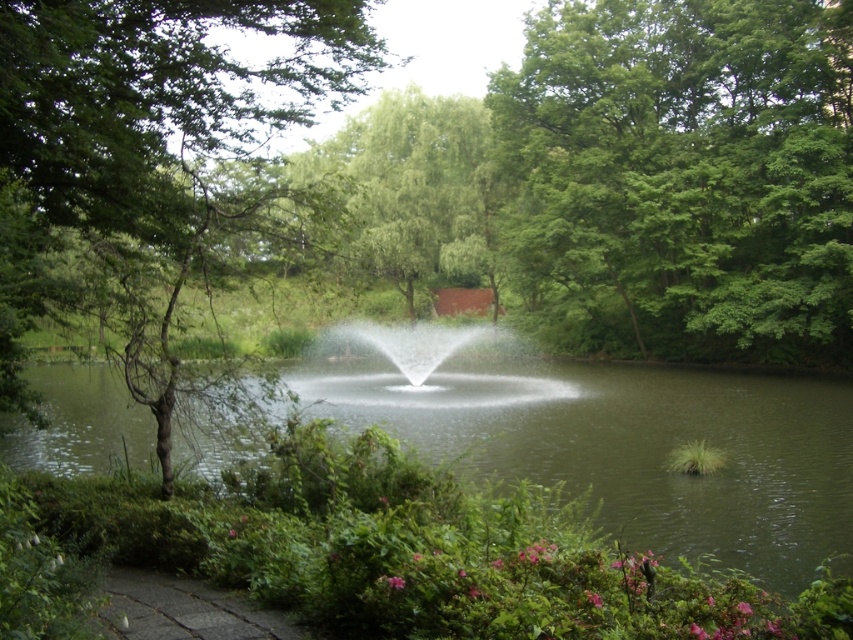
Question: Which point appears farthest from the camera in this image?

Choices:
 (A) (799, 486)
 (B) (16, 264)
 (C) (811, 305)

Answer: (C)

Question: Which object is closer to the camera taking this photo?

Choices:
 (A) clear water at center
 (B) green leafy tree at upper center

Answer: (A)

Question: Is green leafy tree at upper center wider than green leafy tree at center?

Choices:
 (A) yes
 (B) no

Answer: (A)

Question: Can you confirm if clear water at center is smaller than green leafy tree at center?

Choices:
 (A) yes
 (B) no

Answer: (A)

Question: Which is farther from the green leafy tree at center?

Choices:
 (A) green leafy tree at upper center
 (B) clear water at center

Answer: (A)

Question: Does green leafy tree at upper center have a smaller size compared to clear water at center?

Choices:
 (A) yes
 (B) no

Answer: (B)